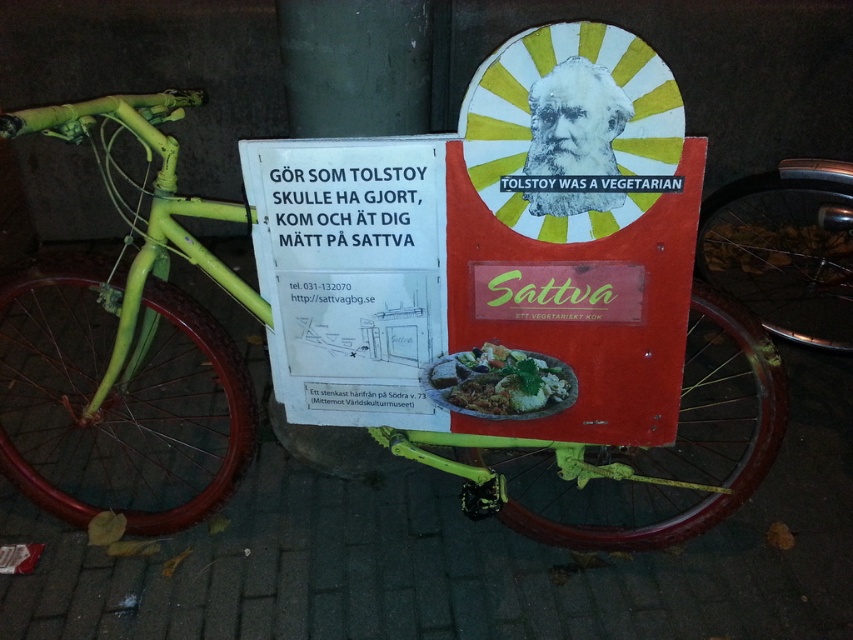
Does green matte bicycle at left have a smaller size compared to matte brown plate at center?

Incorrect, green matte bicycle at left is not smaller in size than matte brown plate at center.

Does green matte bicycle at left appear over matte brown plate at center?

Yes, green matte bicycle at left is above matte brown plate at center.

This screenshot has width=853, height=640. I want to click on green matte bicycle at left, so click(x=154, y=280).

Between green matte bicycle at left and shiny metallic bicycle wheel at lower right, which one has more height?

green matte bicycle at left is taller.

Does green matte bicycle at left come in front of shiny metallic bicycle wheel at lower right?

Yes, it is.

What do you see at coordinates (154, 280) in the screenshot? This screenshot has height=640, width=853. I see `green matte bicycle at left` at bounding box center [154, 280].

Identify the location of green matte bicycle at left. (154, 280).

Which is more to the right, shiny metallic bicycle wheel at lower right or matte brown plate at center?

shiny metallic bicycle wheel at lower right is more to the right.

Who is shorter, shiny metallic bicycle wheel at lower right or matte brown plate at center?

matte brown plate at center is shorter.

Where is `shiny metallic bicycle wheel at lower right`? shiny metallic bicycle wheel at lower right is located at coordinates (785, 248).